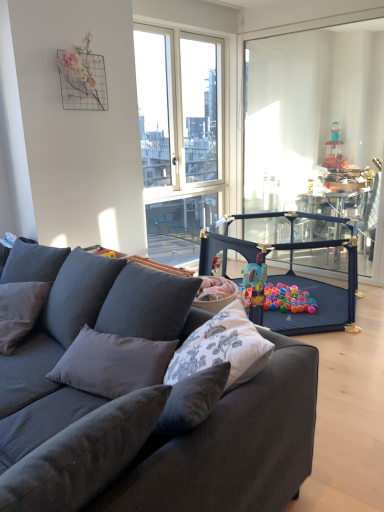
Question: Is transparent plastic playpen at right at the back of dark gray fabric pillow at left?

Choices:
 (A) yes
 (B) no

Answer: (A)

Question: Considering the relative sizes of dark gray fabric pillow at left and transparent plastic playpen at right in the image provided, is dark gray fabric pillow at left smaller than transparent plastic playpen at right?

Choices:
 (A) yes
 (B) no

Answer: (A)

Question: Is dark gray fabric pillow at left taller than transparent plastic playpen at right?

Choices:
 (A) yes
 (B) no

Answer: (B)

Question: Is dark gray fabric pillow at left thinner than transparent plastic playpen at right?

Choices:
 (A) yes
 (B) no

Answer: (B)

Question: Does dark gray fabric pillow at left appear on the left side of transparent plastic playpen at right?

Choices:
 (A) no
 (B) yes

Answer: (B)

Question: Would you say dark gray fabric playpen at center is inside or outside dark gray fabric pillow at left?

Choices:
 (A) inside
 (B) outside

Answer: (B)

Question: Considering the positions of point (228, 222) and point (0, 309), is point (228, 222) closer or farther from the camera than point (0, 309)?

Choices:
 (A) closer
 (B) farther

Answer: (B)

Question: Considering the positions of dark gray fabric playpen at center and dark gray fabric pillow at left in the image, is dark gray fabric playpen at center wider or thinner than dark gray fabric pillow at left?

Choices:
 (A) thin
 (B) wide

Answer: (B)

Question: Based on their sizes in the image, would you say dark gray fabric playpen at center is bigger or smaller than dark gray fabric pillow at left?

Choices:
 (A) small
 (B) big

Answer: (B)

Question: Is transparent plastic playpen at right situated inside dark gray fabric pillow at left or outside?

Choices:
 (A) outside
 (B) inside

Answer: (A)

Question: From a real-world perspective, is transparent plastic playpen at right above or below dark gray fabric pillow at left?

Choices:
 (A) above
 (B) below

Answer: (A)

Question: Considering the positions of point (319, 117) and point (21, 323), is point (319, 117) closer or farther from the camera than point (21, 323)?

Choices:
 (A) farther
 (B) closer

Answer: (A)

Question: In the image, is transparent plastic playpen at right positioned in front of or behind dark gray fabric pillow at left?

Choices:
 (A) behind
 (B) front

Answer: (A)

Question: From the image's perspective, is dark gray fabric couch at center located above or below transparent plastic playpen at right?

Choices:
 (A) above
 (B) below

Answer: (B)

Question: From a real-world perspective, relative to transparent plastic playpen at right, is dark gray fabric couch at center vertically above or below?

Choices:
 (A) above
 (B) below

Answer: (B)